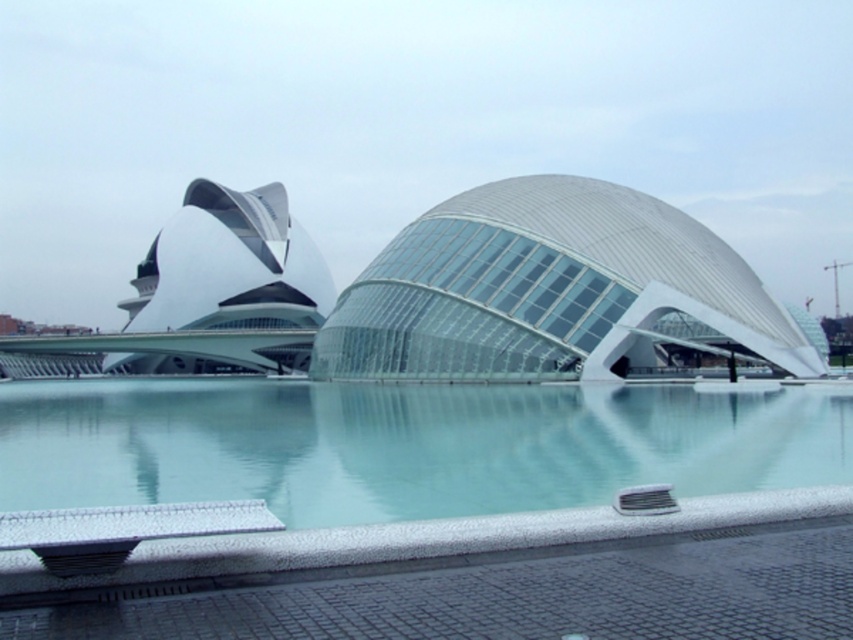
You are standing at the edge of the reflective pool in the architectural complex. You notice two points marked on the ground. One is at coordinates point (485, 186) and the other is at point (294, 397). If you want to walk towards the curved glass building with the white dome, which point should you head towards?

Point (485, 186) is behind point (294, 397). Since the curved glass building with the white dome is the central structure, you should head towards point (294, 397) as it is closer to the building.

You are standing at the entrance of the architectural complex and want to get a clear view of the transparent glass dome at center. Since you are currently at the entrance, which is behind the white speckled tile swimming pool at lower center, do you need to move forward or backward to see it better?

The transparent glass dome at center is above the white speckled tile swimming pool at lower center, so you are currently behind the pool. To see the dome better, you should move forward past the pool to have an unobstructed view.

From the picture: You are standing at the entrance of the architectural complex and want to take a photo of the transparent glass dome at center. Based on its coordinates, where should you position yourself to ensure it is centered in your camera frame?

The transparent glass dome at center is located at point coordinates, so positioning yourself directly in front of it at the entrance should center it in your camera frame.